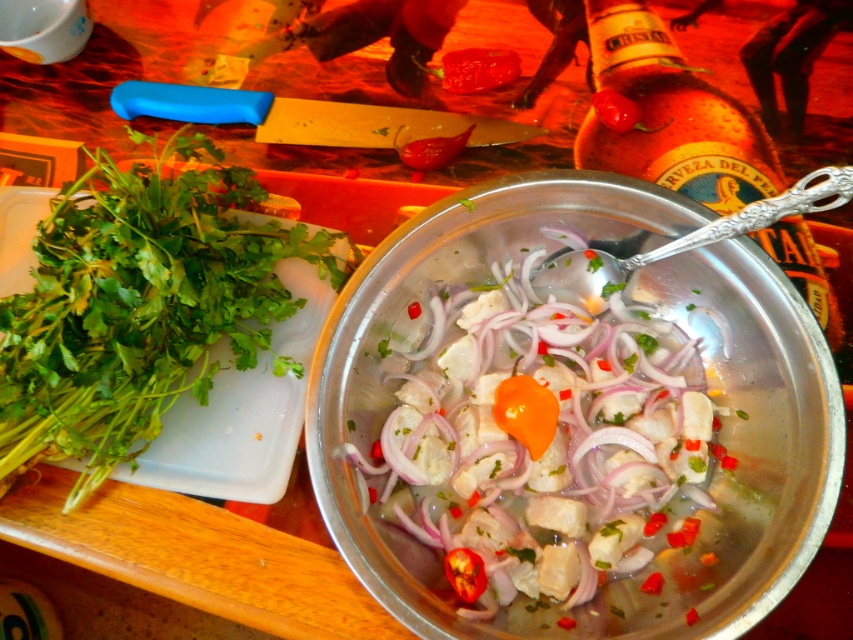
You are a chef preparing a dish and need to grab the green leafy herb at left and the amber glass bottle at center. Which one is closer to your right hand if you are standing to the right of both objects?

The amber glass bottle at center is closer to your right hand because the green leafy herb at left is to the left of the amber glass bottle at center, so the bottle is to the right of the herb.

You are a chef preparing a dish and need to locate the amber glass bottle at center. According to the scene description, where would you find it?

The amber glass bottle at center is located at point (670, 115).